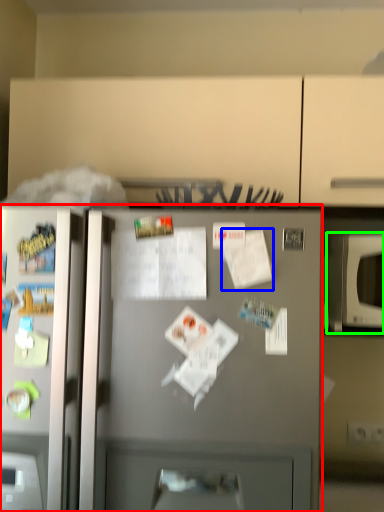
Question: Estimate the real-world distances between objects in this image. Which object is farther from refrigerator (highlighted by a red box), paper (highlighted by a blue box) or microwave oven (highlighted by a green box)?

Choices:
 (A) paper
 (B) microwave oven

Answer: (B)